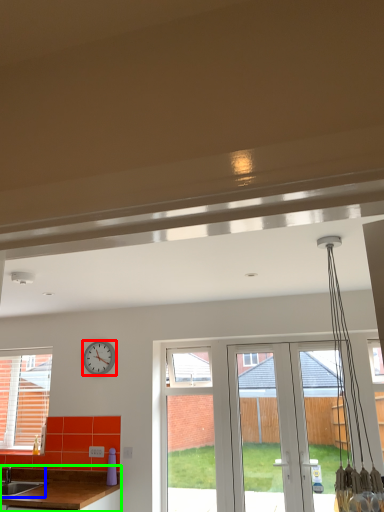
Question: Which object is the farthest from clock (highlighted by a red box)? Choose among these: sink (highlighted by a blue box) or countertop (highlighted by a green box).

Choices:
 (A) sink
 (B) countertop

Answer: (A)